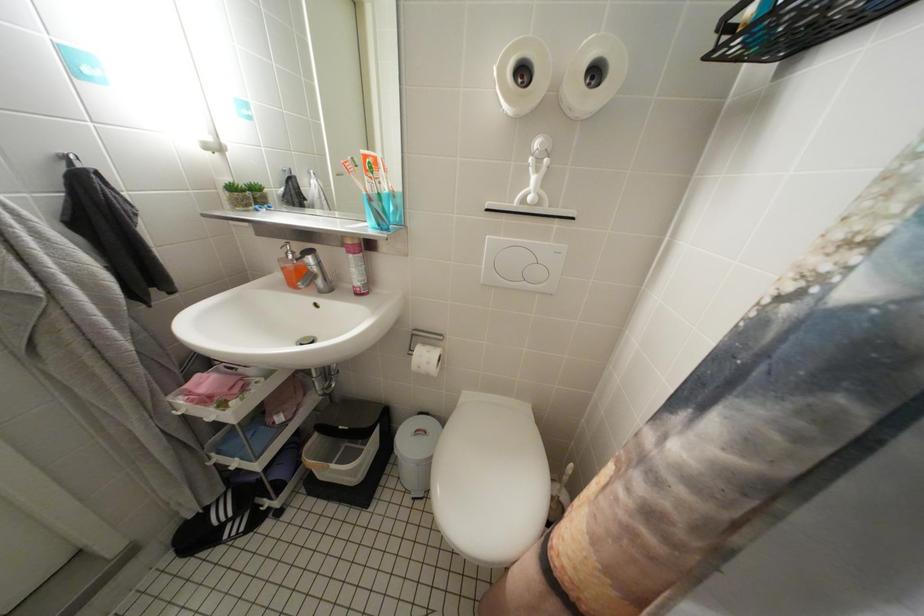
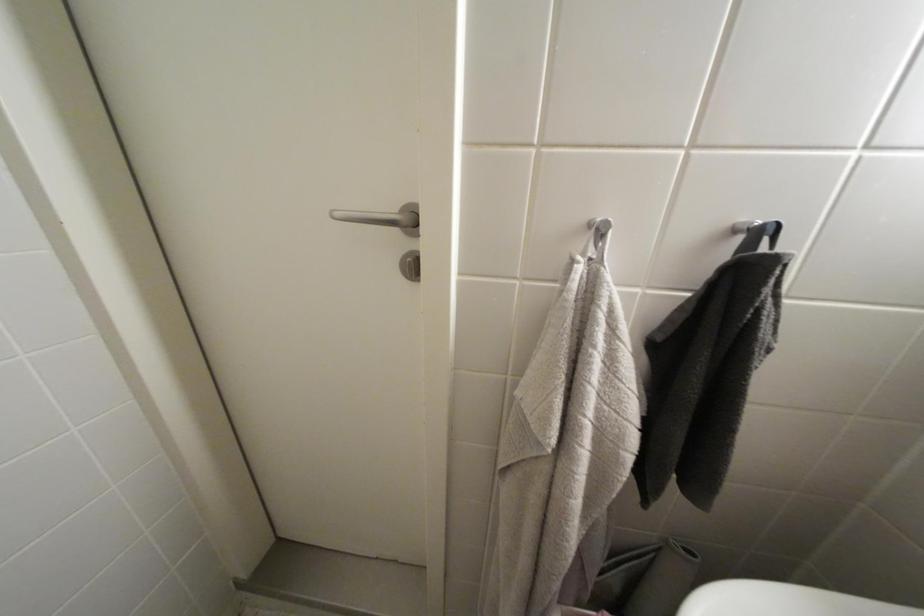
Question: Based on the continuous images, in which direction is the camera rotating? Reply with the corresponding letter.

Choices:
 (A) Left
 (B) Right
 (C) Up
 (D) Down

Answer: (A)